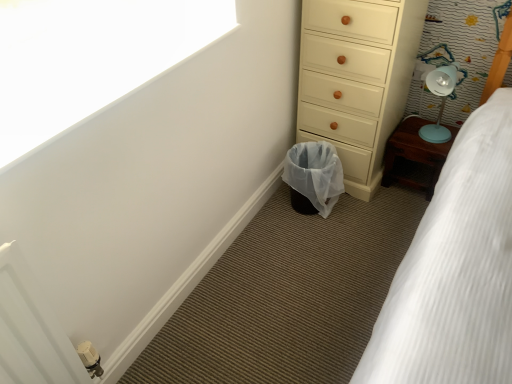
Question: From the image's perspective, is translucent plastic laundry basket at lower center located above or below matte cream chest of drawers at lower right?

Choices:
 (A) below
 (B) above

Answer: (A)

Question: Choose the correct answer: Is translucent plastic laundry basket at lower center inside matte cream chest of drawers at lower right or outside it?

Choices:
 (A) inside
 (B) outside

Answer: (B)

Question: Estimate the real-world distances between objects in this image. Which object is closer to the white matte window screen at upper left?

Choices:
 (A) white textured bed at lower right
 (B) wooden bedside table at right
 (C) translucent plastic laundry basket at lower center
 (D) matte cream chest of drawers at lower right

Answer: (D)

Question: Considering the real-world distances, which object is closest to the white matte window screen at upper left?

Choices:
 (A) white textured bed at lower right
 (B) matte cream chest of drawers at lower right
 (C) translucent plastic laundry basket at lower center
 (D) wooden bedside table at right

Answer: (B)